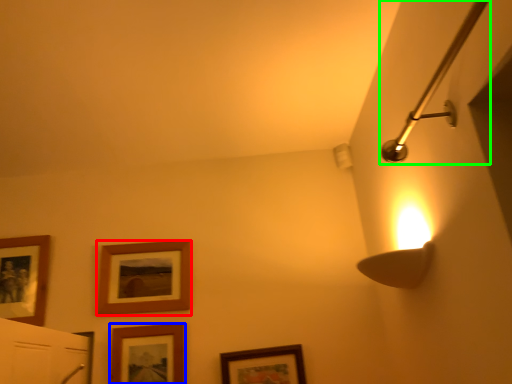
Question: Estimate the real-world distances between objects in this image. Which object is farther from picture frame (highlighted by a red box), picture frame (highlighted by a blue box) or shower (highlighted by a green box)?

Choices:
 (A) picture frame
 (B) shower

Answer: (B)